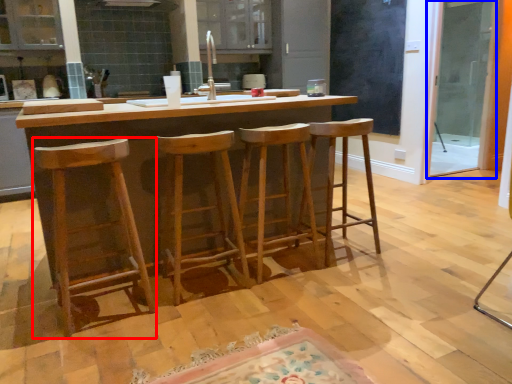
Question: Which object is further to the camera taking this photo, stool (highlighted by a red box) or screen door (highlighted by a blue box)?

Choices:
 (A) stool
 (B) screen door

Answer: (B)